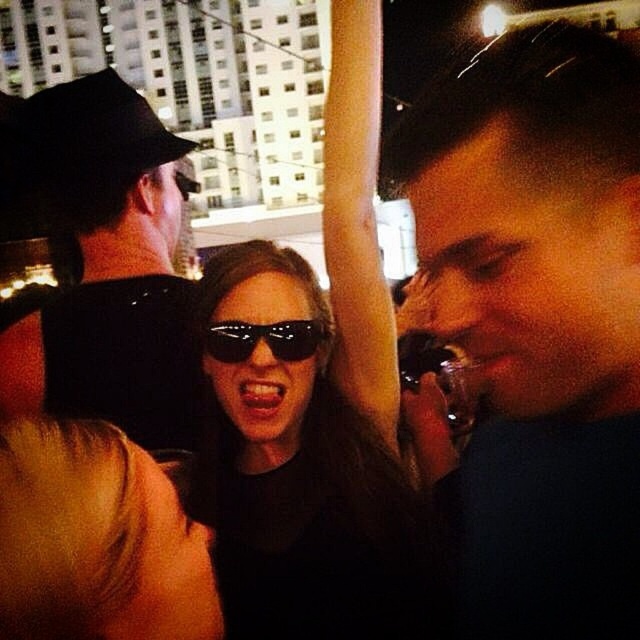
Question: Is black matte sunglasses at center below black matte baseball hat at upper left?

Choices:
 (A) no
 (B) yes

Answer: (B)

Question: Which object is the closest to the black matte sunglasses at center?

Choices:
 (A) matte black phone at center
 (B) black matte baseball hat at upper left
 (C) black reflective sunglasses at center

Answer: (C)

Question: Can you confirm if black matte cap at upper left is wider than black reflective sunglasses at center?

Choices:
 (A) no
 (B) yes

Answer: (B)

Question: Does black matte sunglasses at center appear under black matte cap at upper left?

Choices:
 (A) no
 (B) yes

Answer: (B)

Question: Considering the real-world distances, which object is closest to the black matte cap at upper left?

Choices:
 (A) black matte sunglasses at center
 (B) black reflective sunglasses at center

Answer: (A)

Question: Which of the following is the farthest from the observer?

Choices:
 (A) black matte cap at upper left
 (B) black matte baseball hat at upper left
 (C) black matte sunglasses at center

Answer: (B)